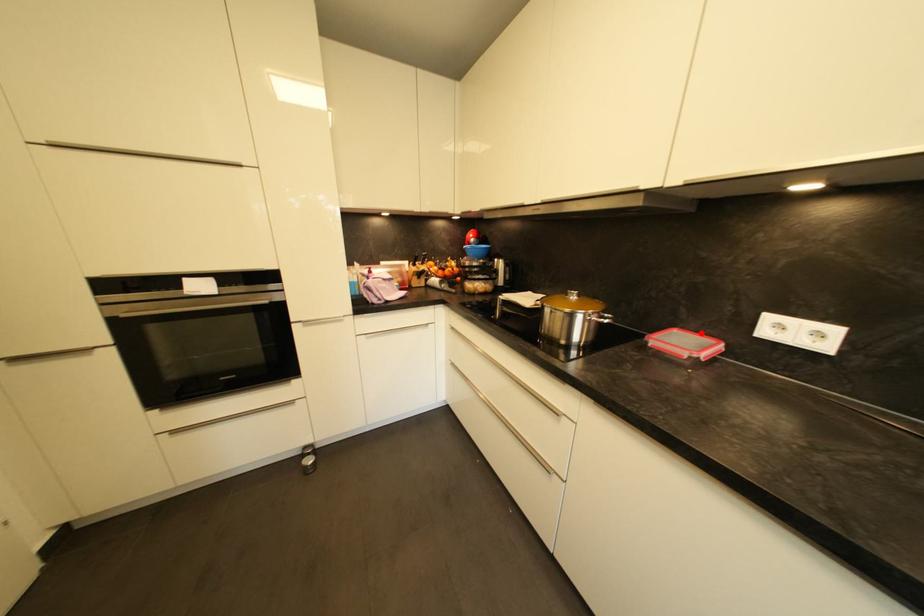
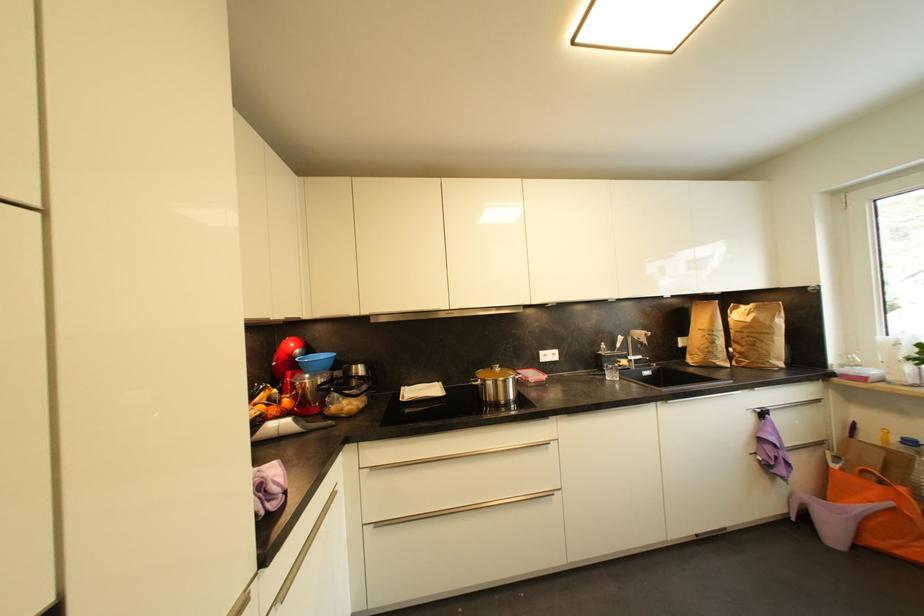
Question: I am providing you with two images of the same scene from different viewpoints. In image1, a red point is highlighted. Considering the same 3D point in image2, which of the following is correct?

Choices:
 (A) It is closer
 (B) It is farther

Answer: (B)